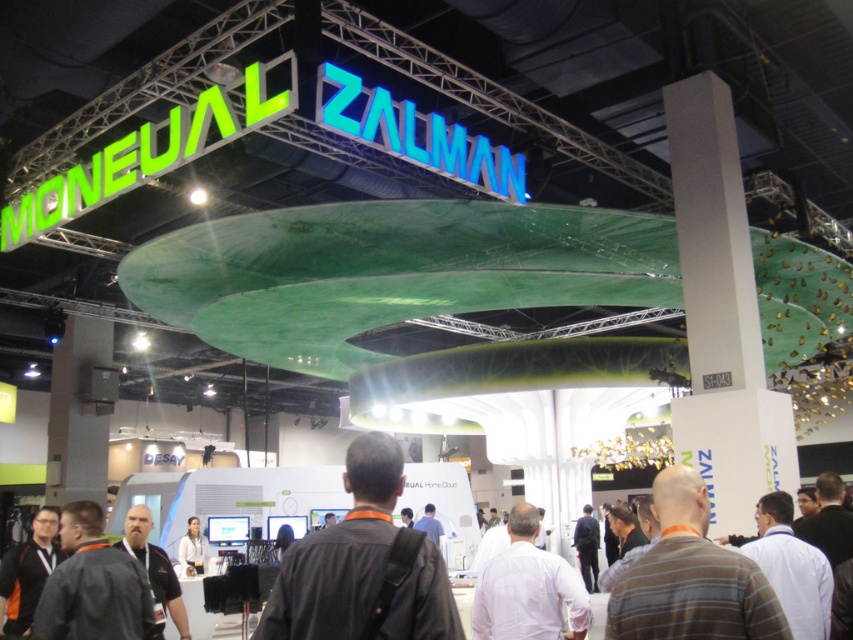
You are a photographer at the exhibition hall and want to capture both the black leather jacket at lower left and the dark gray fabric jacket at lower left in a single shot. Since you can only focus on one jacket at a time, which jacket should you focus on to ensure the other remains in the background?

You should focus on the black leather jacket at lower left because it is located above the dark gray fabric jacket at lower left, meaning the dark gray fabric jacket at lower left will naturally be in the background when the black leather jacket at lower left is in focus.

You are a visitor at the exhibition hall and want to place your belongings near the MONEUAL ZALMAN booth. The booth has a large curved green structure. Where should you place your backpack so that it is exactly at the center of the booth? The options are the black fabric backpack at center or another location not listed. Which is correct?

The black fabric backpack at center is already placed at the center of the booth, as its 2D location is at point (363, 564), which corresponds to the center position.

You are attending the tech exhibition and need to locate the brown plaid shirt at lower right. Based on the coordinates provided, where exactly is it positioned in the image?

The brown plaid shirt at lower right is located at point coordinates of 0.903 on the x axis and 0.811 on the y axis.